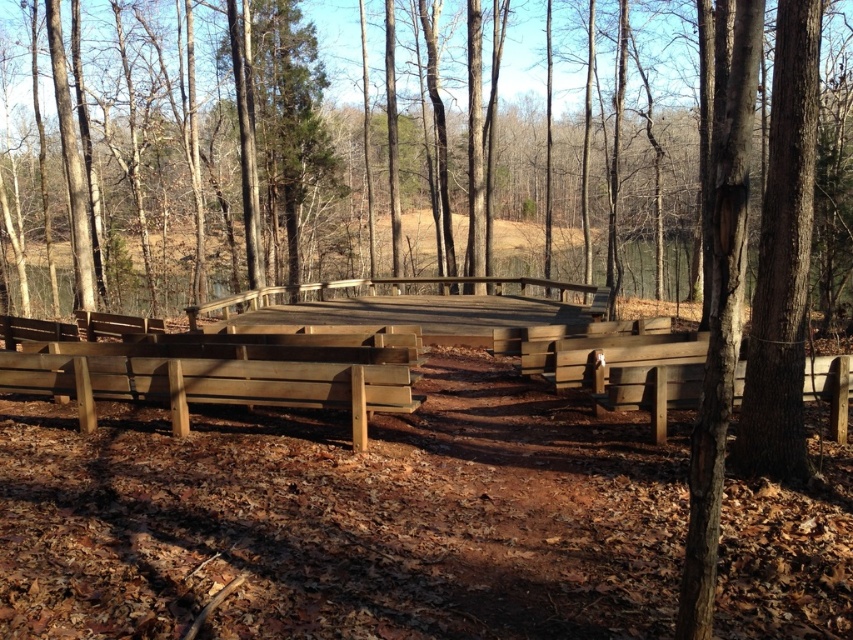
You are standing at the center of the amphitheater and want to sit down. Which direction should you walk to reach the wooden bench at lower center?

The wooden bench at lower center is located at point [210,385], so you should walk towards the lower center direction to reach it.

You are planning to set up a small table for refreshments between the wooden bench at lower center and the wooden bench at right. Based on their widths, which bench should the table be placed closer to?

The wooden bench at lower center might be wider than the wooden bench at right, so the table should be placed closer to the wooden bench at right to ensure there is enough space.

Looking at this image, you are attending a small outdoor event at the amphitheater and need to choose seating. You want to sit on a bench that is higher up to get a better view. Based on the image, which bench should you choose between the wooden bench at lower center and the wooden bench at right?

The wooden bench at lower center is taller than the wooden bench at right, so you should choose the wooden bench at lower center to get a better view.